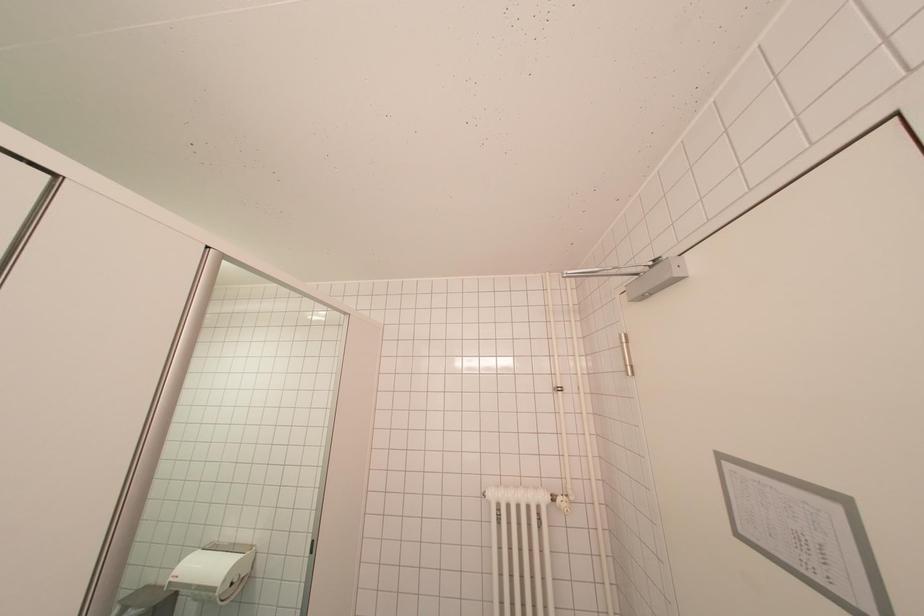
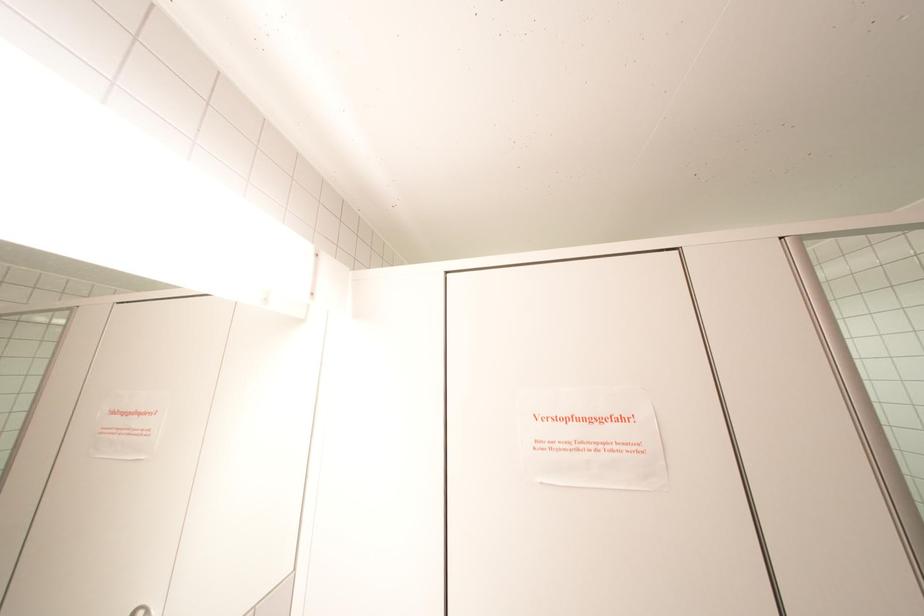
First-person continuous shooting, in which direction is the camera rotating?

The camera rotated toward left-up.